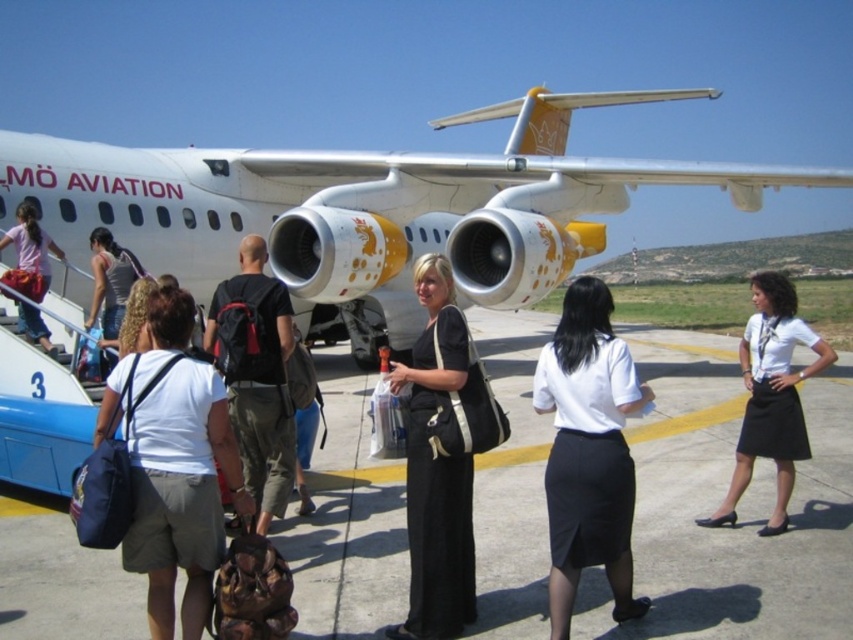
Which of these two, white smooth skirt at center or black backpack at center, stands taller?

Standing taller between the two is black backpack at center.

Which is more to the left, white smooth skirt at center or black backpack at center?

From the viewer's perspective, black backpack at center appears more on the left side.

Does point (608, 296) come farther from viewer compared to point (253, 397)?

No, it is not.

In order to click on white smooth skirt at center in this screenshot , I will do `click(589, 451)`.

What do you see at coordinates (178, 470) in the screenshot? The image size is (853, 640). I see `white cotton shirt at center` at bounding box center [178, 470].

Is point (199, 374) more distant than point (575, 406)?

That is False.

This screenshot has height=640, width=853. I want to click on white cotton shirt at center, so click(178, 470).

Does white glossy airplane at center appear over white smooth skirt at center?

Indeed, white glossy airplane at center is positioned over white smooth skirt at center.

Is white glossy airplane at center closer to camera compared to white smooth skirt at center?

No, it is behind white smooth skirt at center.

Which is in front, point (740, 168) or point (602, 408)?

Positioned in front is point (602, 408).

You are a GUI agent. You are given a task and a screenshot of the screen. Output one action in this format:
    pyautogui.click(x=<x>, y=<y>)
    Task: Click on the white glossy airplane at center
    
    Given the screenshot: What is the action you would take?
    pyautogui.click(x=370, y=209)